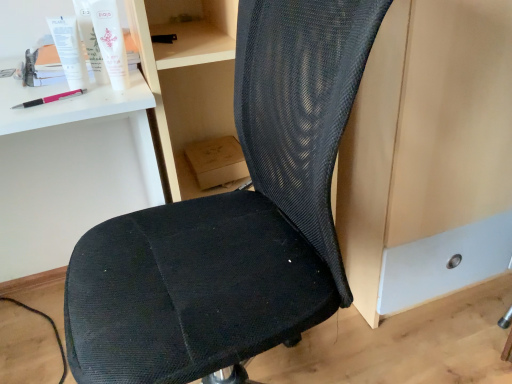
Question: Is pink plastic pen at upper left taller or shorter than white matte desk at upper left?

Choices:
 (A) short
 (B) tall

Answer: (A)

Question: Does point (37, 99) appear closer or farther from the camera than point (48, 162)?

Choices:
 (A) closer
 (B) farther

Answer: (A)

Question: Based on their relative distances, which object is farther from the white matte desk at upper left?

Choices:
 (A) black mesh chair at center
 (B) white matte tube at upper left, the second toiletry when ordered from right to left
 (C) pink plastic pen at upper left
 (D) white plastic tube at upper left
 (E) white matte tube at upper left, the second toiletry viewed from the left

Answer: (B)

Question: Based on their relative distances, which object is nearer to the pink plastic pen at upper left?

Choices:
 (A) black mesh chair at center
 (B) white matte desk at upper left
 (C) white matte tube at upper left, which ranks as the 1th toiletry in right-to-left order
 (D) white matte tube at upper left, the second toiletry when ordered from right to left
 (E) white plastic tube at upper left

Answer: (E)